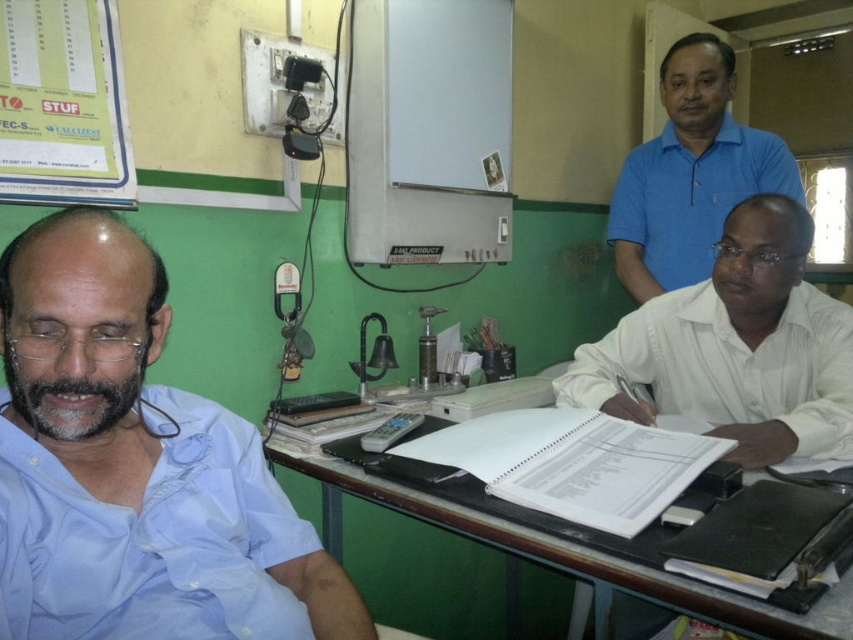
Question: Can you confirm if brown wooden table at center is smaller than white plastic stapler at center?

Choices:
 (A) yes
 (B) no

Answer: (B)

Question: Which object is the farthest from the white paper at center?

Choices:
 (A) blue cotton shirt at left
 (B) white paper at upper left
 (C) brown wooden table at center
 (D) blue polo shirt at upper center

Answer: (B)

Question: Is blue cotton shirt at left thinner than gray plastic remote control at center?

Choices:
 (A) no
 (B) yes

Answer: (A)

Question: Which object is the closest to the blue cotton shirt at left?

Choices:
 (A) gray plastic remote control at center
 (B) blue polo shirt at upper center
 (C) white plastic stapler at center
 (D) white paper at center

Answer: (A)

Question: Which of the following is the closest to the observer?

Choices:
 (A) brown wooden table at center
 (B) white plastic stapler at center

Answer: (A)

Question: Is white paper at center above white plastic stapler at center?

Choices:
 (A) yes
 (B) no

Answer: (A)